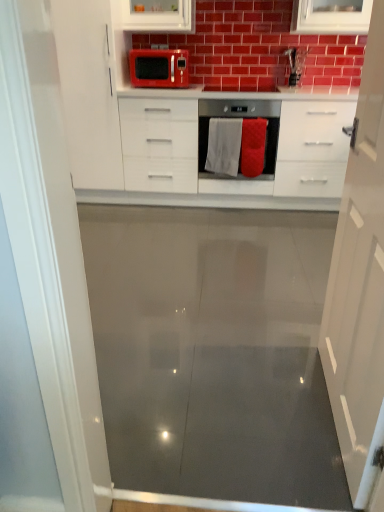
Describe the element at coordinates (360, 287) in the screenshot. I see `white glossy cabinet at center, which is the 2th cabinetry from left to right` at that location.

What do you see at coordinates (89, 92) in the screenshot? The width and height of the screenshot is (384, 512). I see `white glossy cabinet at left, which is the 1th cabinetry in left-to-right order` at bounding box center [89, 92].

Where is `satin silver oven at center`? The width and height of the screenshot is (384, 512). satin silver oven at center is located at coordinates (239, 117).

At what (x,y) coordinates should I click in order to perform the action: click on white fabric towel at center, the second material when ordered from right to left. Please return your answer as a coordinate pair (x, y). Image resolution: width=384 pixels, height=512 pixels. Looking at the image, I should click on (224, 146).

From the image's perspective, does white glossy cabinet at center appear lower than white glossy cabinet at center, the 1th cabinetry positioned from the front?

Incorrect, from the image's perspective, white glossy cabinet at center is higher than white glossy cabinet at center, the 1th cabinetry positioned from the front.

Considering the positions of objects white glossy cabinet at center and white glossy cabinet at center, which is the 2th cabinetry from left to right, in the image provided, who is more to the left, white glossy cabinet at center or white glossy cabinet at center, which is the 2th cabinetry from left to right,?

white glossy cabinet at center.

From a real-world perspective, is white glossy cabinet at center beneath white glossy cabinet at center, the second cabinetry viewed from the back?

Yes, from a real-world perspective, white glossy cabinet at center is beneath white glossy cabinet at center, the second cabinetry viewed from the back.

Would you say matte red microwave at upper center contains red fabric towel at center, marked as the 2th material in a left-to-right arrangement?

Actually, red fabric towel at center, marked as the 2th material in a left-to-right arrangement, is outside matte red microwave at upper center.

What's the angular difference between matte red microwave at upper center and red fabric towel at center, which ranks as the first material in right-to-left order,'s facing directions?

The angular difference between matte red microwave at upper center and red fabric towel at center, which ranks as the first material in right-to-left order, is 0.194 degrees.

From the image's perspective, would you say matte red microwave at upper center is shown under red fabric towel at center, marked as the 2th material in a left-to-right arrangement?

No, from the image's perspective, matte red microwave at upper center is not below red fabric towel at center, marked as the 2th material in a left-to-right arrangement.

Is point (154, 55) positioned behind point (259, 174)?

No, (154, 55) is closer to viewer.

Find the location of a particular element. material located above the red fabric towel at center, marked as the 2th material in a left-to-right arrangement (from a real-world perspective) is located at coordinates (224, 146).

Which of these two, white fabric towel at center, which is the 1th material from left to right, or red fabric towel at center, marked as the 2th material in a left-to-right arrangement, stands shorter?

white fabric towel at center, which is the 1th material from left to right, is shorter.

Between white fabric towel at center, which is the 1th material from left to right, and red fabric towel at center, which ranks as the first material in right-to-left order, which one has smaller size?

red fabric towel at center, which ranks as the first material in right-to-left order, is smaller.

Between white fabric towel at center, which is the 1th material from left to right, and red fabric towel at center, which ranks as the first material in right-to-left order, which one is positioned behind?

white fabric towel at center, which is the 1th material from left to right, is behind.

Is white glossy cabinet at center outside of white glossy cabinet at left, marked as the second cabinetry in a front-to-back arrangement?

white glossy cabinet at center lies outside white glossy cabinet at left, marked as the second cabinetry in a front-to-back arrangement,'s area.

Identify the location of the chest of drawers lying behind the white glossy cabinet at left, which ranks as the second cabinetry in bottom-to-top order. (236, 180).

From the image's perspective, would you say white glossy cabinet at center is positioned over white glossy cabinet at left, which is the 1th cabinetry in left-to-right order?

Incorrect, from the image's perspective, white glossy cabinet at center is lower than white glossy cabinet at left, which is the 1th cabinetry in left-to-right order.

Between white glossy cabinet at center and white glossy cabinet at left, which is the 1th cabinetry in left-to-right order, which one appears on the right side from the viewer's perspective?

white glossy cabinet at center.

Which point is more forward, (269,102) or (139,73)?

The point (269,102) is in front.

In the scene shown: Based on their sizes in the image, would you say satin silver oven at center is bigger or smaller than matte red microwave at upper center?

satin silver oven at center is bigger than matte red microwave at upper center.

From the image's perspective, is satin silver oven at center on top of matte red microwave at upper center?

No.

Considering the relative sizes of white glossy cabinet at center, the 2th cabinetry positioned from the top, and white glossy cabinet at left, the first cabinetry viewed from the back, in the image provided, is white glossy cabinet at center, the 2th cabinetry positioned from the top, shorter than white glossy cabinet at left, the first cabinetry viewed from the back,?

Yes.

Is white glossy cabinet at center, which is the 2th cabinetry from left to right, placed right next to white glossy cabinet at left, marked as the second cabinetry in a front-to-back arrangement?

No, white glossy cabinet at center, which is the 2th cabinetry from left to right, is not with white glossy cabinet at left, marked as the second cabinetry in a front-to-back arrangement.

Is white glossy cabinet at center, which is the 2th cabinetry from left to right, aimed at white glossy cabinet at left, which is the 1th cabinetry in left-to-right order?

No, white glossy cabinet at center, which is the 2th cabinetry from left to right, is not facing towards white glossy cabinet at left, which is the 1th cabinetry in left-to-right order.

Considering the relative sizes of white glossy cabinet at center, the 1th cabinetry positioned from the front, and white glossy cabinet at left, the first cabinetry viewed from the back, in the image provided, is white glossy cabinet at center, the 1th cabinetry positioned from the front, bigger than white glossy cabinet at left, the first cabinetry viewed from the back,?

Incorrect, white glossy cabinet at center, the 1th cabinetry positioned from the front, is not larger than white glossy cabinet at left, the first cabinetry viewed from the back.

From a real-world perspective, is satin silver oven at center positioned above or below white glossy cabinet at center?

Clearly, from a real-world perspective, satin silver oven at center is above white glossy cabinet at center.

Considering the sizes of objects satin silver oven at center and white glossy cabinet at center in the image provided, who is thinner, satin silver oven at center or white glossy cabinet at center?

satin silver oven at center.

Does satin silver oven at center come behind white glossy cabinet at center?

Yes, satin silver oven at center is further from the viewer.

Where is `the 2nd cabinetry in front of the white glossy cabinet at center`? The width and height of the screenshot is (384, 512). the 2nd cabinetry in front of the white glossy cabinet at center is located at coordinates (360, 287).

From a real-world perspective, count 2nd materials downward from the matte red microwave at upper center and point to it. Please provide its 2D coordinates.

[(253, 146)]

Considering their positions, is satin silver oven at center positioned closer to white glossy cabinet at left, marked as the second cabinetry in a front-to-back arrangement, than red fabric towel at center, which ranks as the first material in right-to-left order?

satin silver oven at center is closer to white glossy cabinet at left, marked as the second cabinetry in a front-to-back arrangement.

From the image, which object appears to be nearer to red fabric towel at center, marked as the 2th material in a left-to-right arrangement, matte red microwave at upper center or white glossy cabinet at left, which ranks as the second cabinetry in bottom-to-top order?

Among the two, matte red microwave at upper center is located nearer to red fabric towel at center, marked as the 2th material in a left-to-right arrangement.

Considering their positions, is white glossy cabinet at left, marked as the second cabinetry in a front-to-back arrangement, positioned closer to matte red microwave at upper center than white glossy cabinet at center, the first cabinetry positioned from the right?

Based on the image, white glossy cabinet at left, marked as the second cabinetry in a front-to-back arrangement, appears to be nearer to matte red microwave at upper center.

When comparing their distances from white glossy cabinet at center, does white glossy cabinet at center, the 2th cabinetry positioned from the top, or white glossy cabinet at left, the first cabinetry viewed from the back, seem further?

The object further to white glossy cabinet at center is white glossy cabinet at center, the 2th cabinetry positioned from the top.

Looking at the image, which one is located closer to white glossy cabinet at left, the first cabinetry from the top, white fabric towel at center, the second material when ordered from right to left, or matte red microwave at upper center?

Based on the image, matte red microwave at upper center appears to be nearer to white glossy cabinet at left, the first cabinetry from the top.

Considering their positions, is red fabric towel at center, marked as the 2th material in a left-to-right arrangement, positioned further to matte red microwave at upper center than white glossy cabinet at center, the second cabinetry viewed from the back?

white glossy cabinet at center, the second cabinetry viewed from the back, is further to matte red microwave at upper center.

Which object lies further to the anchor point white fabric towel at center, which is the 1th material from left to right, white glossy cabinet at left, marked as the second cabinetry in a front-to-back arrangement, or satin silver oven at center?

Based on the image, white glossy cabinet at left, marked as the second cabinetry in a front-to-back arrangement, appears to be further to white fabric towel at center, which is the 1th material from left to right.

When comparing their distances from satin silver oven at center, does matte red microwave at upper center or white glossy cabinet at center seem closer?

white glossy cabinet at center is positioned closer to the anchor satin silver oven at center.

Identify the location of chest of drawers between white glossy cabinet at center, marked as the 1th cabinetry in a bottom-to-top arrangement, and satin silver oven at center, along the z-axis. Image resolution: width=384 pixels, height=512 pixels. (236, 180).

You are a GUI agent. You are given a task and a screenshot of the screen. Output one action in this format:
    pyautogui.click(x=<x>, y=<y>)
    Task: Click on the cabinetry between white glossy cabinet at center, marked as the 1th cabinetry in a bottom-to-top arrangement, and red fabric towel at center, marked as the 2th material in a left-to-right arrangement, along the z-axis
    The height and width of the screenshot is (512, 384).
    Given the screenshot: What is the action you would take?
    pyautogui.click(x=89, y=92)

Identify the location of cabinetry located between white glossy cabinet at center, marked as the 1th cabinetry in a bottom-to-top arrangement, and matte red microwave at upper center in the depth direction. This screenshot has width=384, height=512. (89, 92).

At what (x,y) coordinates should I click in order to perform the action: click on material between white glossy cabinet at center, the 2th cabinetry positioned from the top, and satin silver oven at center, along the z-axis. Please return your answer as a coordinate pair (x, y). The image size is (384, 512). Looking at the image, I should click on (253, 146).